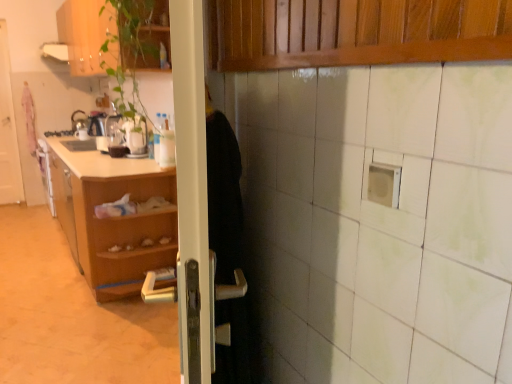
Question: Is wooden cabinet at upper left taller than wooden at left?

Choices:
 (A) no
 (B) yes

Answer: (A)

Question: Does wooden cabinet at upper left contain wooden at left?

Choices:
 (A) no
 (B) yes

Answer: (A)

Question: From a real-world perspective, is wooden cabinet at upper left on wooden at left?

Choices:
 (A) no
 (B) yes

Answer: (B)

Question: Is wooden cabinet at upper left looking in the opposite direction of wooden at left?

Choices:
 (A) no
 (B) yes

Answer: (A)

Question: Can you confirm if wooden cabinet at upper left is shorter than wooden at left?

Choices:
 (A) yes
 (B) no

Answer: (A)

Question: Is the position of wooden cabinet at upper left less distant than that of wooden at left?

Choices:
 (A) no
 (B) yes

Answer: (B)

Question: Is shiny metallic kettle at left placed right next to white glossy exhaust hood at upper left?

Choices:
 (A) yes
 (B) no

Answer: (B)

Question: Considering the relative sizes of shiny metallic kettle at left and white glossy exhaust hood at upper left in the image provided, is shiny metallic kettle at left bigger than white glossy exhaust hood at upper left?

Choices:
 (A) no
 (B) yes

Answer: (A)

Question: Is shiny metallic kettle at left not inside white glossy exhaust hood at upper left?

Choices:
 (A) no
 (B) yes

Answer: (B)

Question: Could you tell me if shiny metallic kettle at left is facing white glossy exhaust hood at upper left?

Choices:
 (A) yes
 (B) no

Answer: (B)

Question: Considering the relative sizes of shiny metallic kettle at left and white glossy exhaust hood at upper left in the image provided, is shiny metallic kettle at left smaller than white glossy exhaust hood at upper left?

Choices:
 (A) no
 (B) yes

Answer: (B)

Question: Is shiny metallic kettle at left at the left side of white glossy exhaust hood at upper left?

Choices:
 (A) yes
 (B) no

Answer: (A)

Question: From a real-world perspective, is white glossy exhaust hood at upper left physically below white glossy door at left?

Choices:
 (A) yes
 (B) no

Answer: (B)